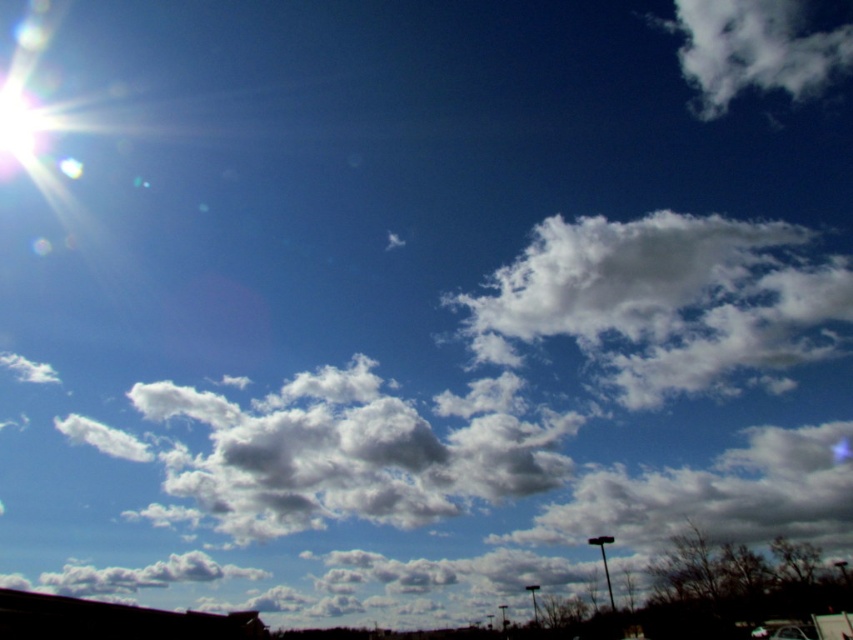
You are an astronomer analyzing the sky scene. You notice two points in the upper part of the image. The first point is located at coordinates point (809,97) and the second at point (815,637). Which point is closer to your observation equipment?

Point (809,97) is further to the viewer than point (815,637), so the second point is closer to your observation equipment.

You are an astronomer analyzing this image. You notice a point at coordinates (753, 51). Based on the scene description, what object does this point likely correspond to?

The point at coordinates (753, 51) corresponds to the white fluffy cloud at upper right.